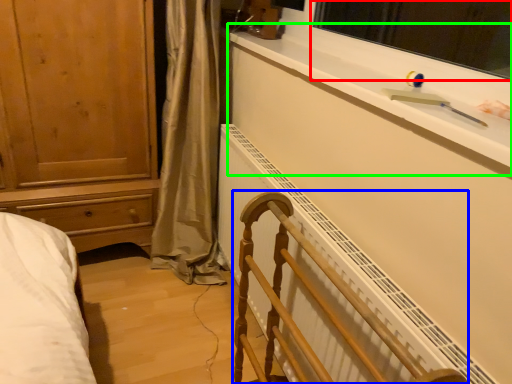
Question: Which object is the closest to the window screen (highlighted by a red box)? Choose among these: furniture (highlighted by a blue box) or window sill (highlighted by a green box).

Choices:
 (A) furniture
 (B) window sill

Answer: (B)